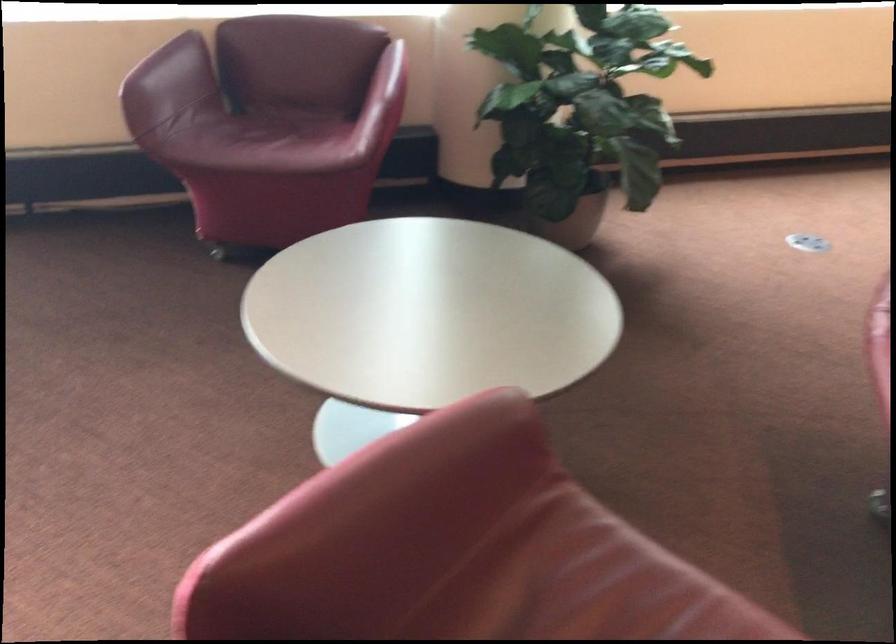
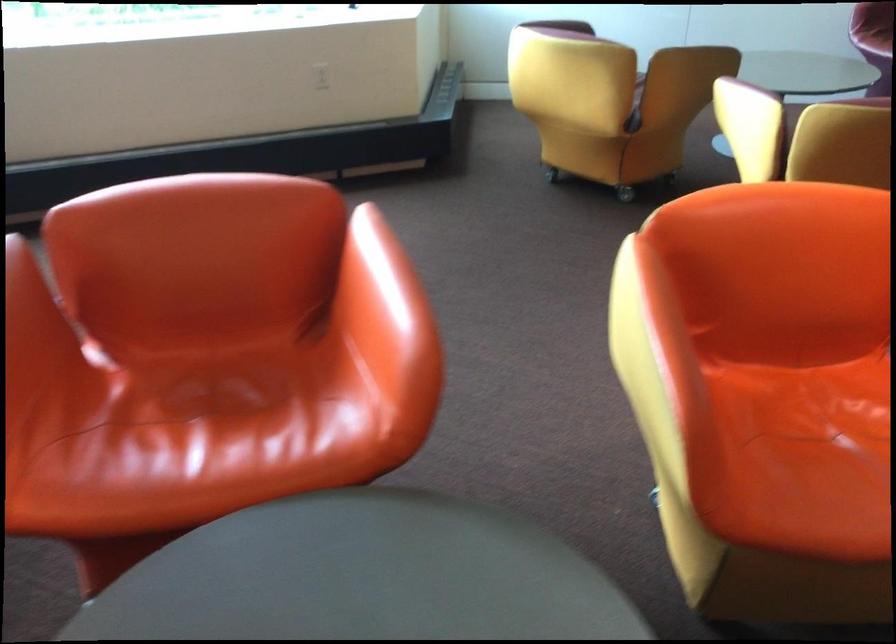
Question: What movement of the cameraman would produce the second image?

Choices:
 (A) Left
 (B) Right
 (C) Forward
 (D) Backward

Answer: (B)